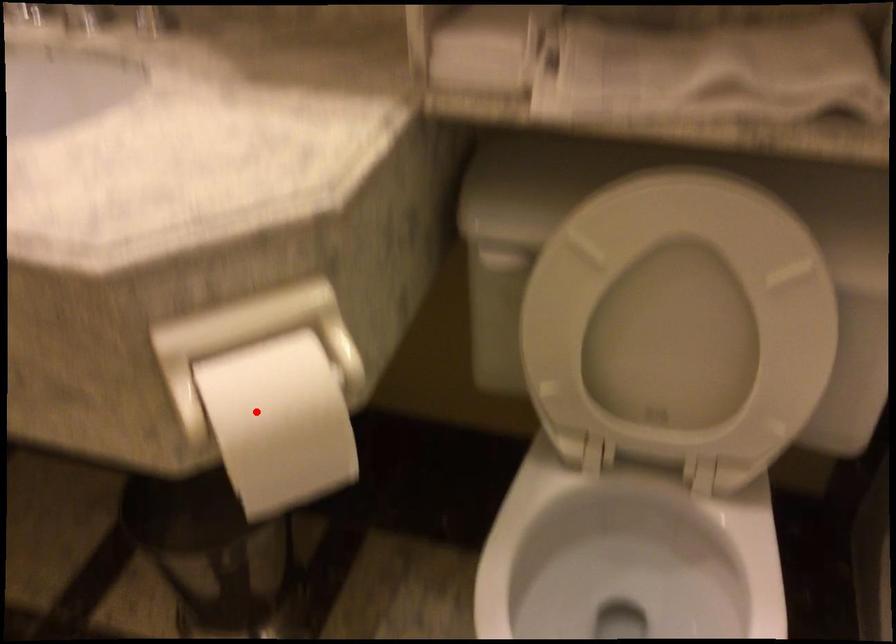
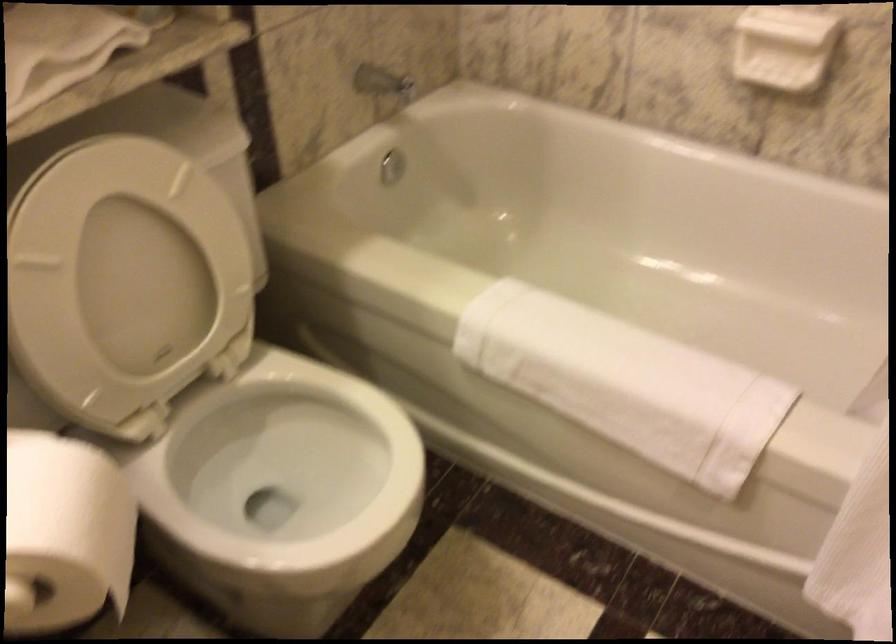
Question: I am providing you with two images of the same scene from different viewpoints. Given a red point in image1, look at the same physical point in image2. Is it:

Choices:
 (A) Closer to the viewpoint
 (B) Farther from the viewpoint

Answer: (A)